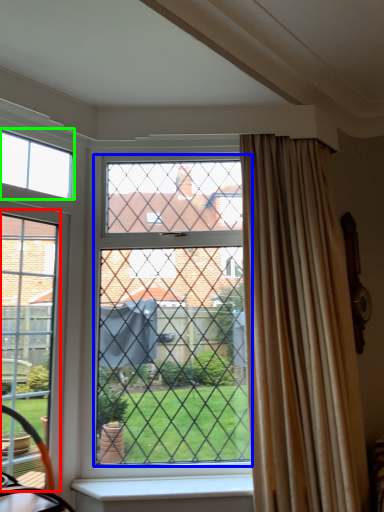
Question: Estimate the real-world distances between objects in this image. Which object is closer to screen door (highlighted by a red box), glass window (highlighted by a blue box) or window (highlighted by a green box)?

Choices:
 (A) glass window
 (B) window

Answer: (B)